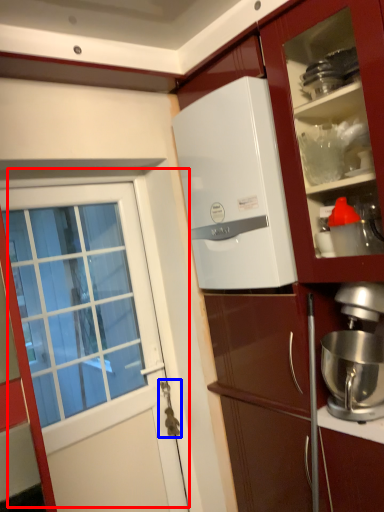
Question: Among these objects, which one is farthest to the camera, door (highlighted by a red box) or door handle (highlighted by a blue box)?

Choices:
 (A) door
 (B) door handle

Answer: (B)